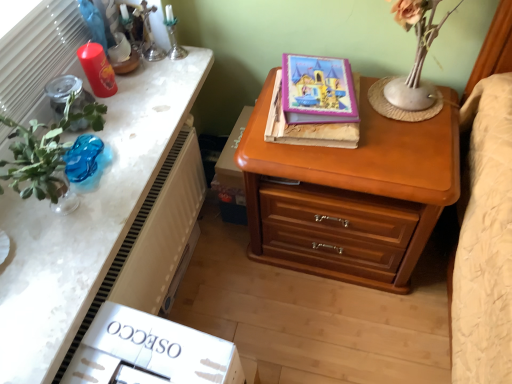
Question: From a real-world perspective, is purple glossy book at upper center, placed as the first book when sorted from top to bottom, positioned above or below wooden chest of drawers at right?

Choices:
 (A) below
 (B) above

Answer: (B)

Question: Relative to wooden chest of drawers at right, is purple glossy book at upper center, which ranks as the second book in bottom-to-top order, in front or behind?

Choices:
 (A) behind
 (B) front

Answer: (A)

Question: Which of these objects is positioned closest to the purple glossy book at upper center, placed as the first book when sorted from top to bottom?

Choices:
 (A) wooden chest of drawers at right
 (B) white textured radiator at left
 (C) wooden nightstand at upper center
 (D) hardcover book at center, positioned as the 2th book in top-to-bottom order
 (E) translucent blue glass vase at left

Answer: (D)

Question: Based on their relative distances, which object is farther from the wooden nightstand at upper center?

Choices:
 (A) translucent blue glass vase at left
 (B) hardcover book at center, which is the 1th book from bottom to top
 (C) white textured radiator at left
 (D) purple glossy book at upper center, placed as the first book when sorted from top to bottom
 (E) wooden chest of drawers at right

Answer: (E)